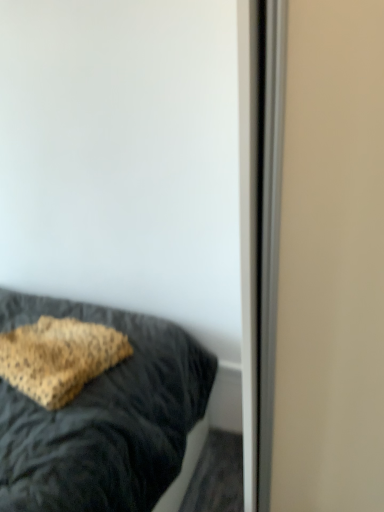
Question: Looking at their shapes, would you say leopard print fabric pillow at lower left is wider or thinner than leopard print pillow at center?

Choices:
 (A) wide
 (B) thin

Answer: (B)

Question: From a real-world perspective, relative to leopard print pillow at center, is leopard print fabric pillow at lower left vertically above or below?

Choices:
 (A) below
 (B) above

Answer: (B)

Question: Is point (49, 328) closer or farther from the camera than point (26, 450)?

Choices:
 (A) closer
 (B) farther

Answer: (B)

Question: Considering the positions of leopard print pillow at center and leopard print fabric pillow at lower left in the image, is leopard print pillow at center wider or thinner than leopard print fabric pillow at lower left?

Choices:
 (A) thin
 (B) wide

Answer: (B)

Question: Is leopard print pillow at center taller or shorter than leopard print fabric pillow at lower left?

Choices:
 (A) short
 (B) tall

Answer: (B)

Question: From the image's perspective, is leopard print pillow at center located above or below leopard print fabric pillow at lower left?

Choices:
 (A) below
 (B) above

Answer: (A)

Question: In the image, is leopard print pillow at center on the left side or the right side of leopard print fabric pillow at lower left?

Choices:
 (A) right
 (B) left

Answer: (B)